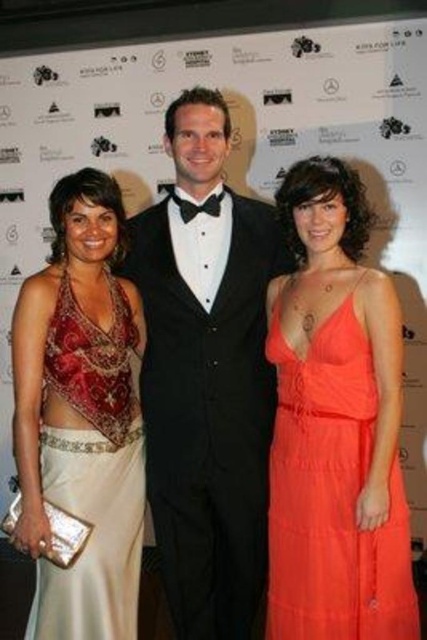
Based on the scene description, which object is located at the coordinates point (207, 374)?

The black satin tuxedo at center is located at point (207, 374).

You are a photographer trying to adjust the lighting for the group photo. Since the black satin tuxedo at center and the satin gold dress at left are close to each other, which one might cast a larger shadow on the backdrop?

The black satin tuxedo at center is positioned over the satin gold dress at left, so it will cast a larger shadow on the backdrop because it is closer to the light source.

You are a photographer setting up for a group photo. You need to ensure that the orange chiffon dress at center and the satin gold dress at left are both visible in the frame. Based on their positions, which dress should you focus on first to capture both effectively?

The orange chiffon dress at center is located above the satin gold dress at left, so focusing on the orange chiffon dress at center first will help ensure both dresses are in the frame.